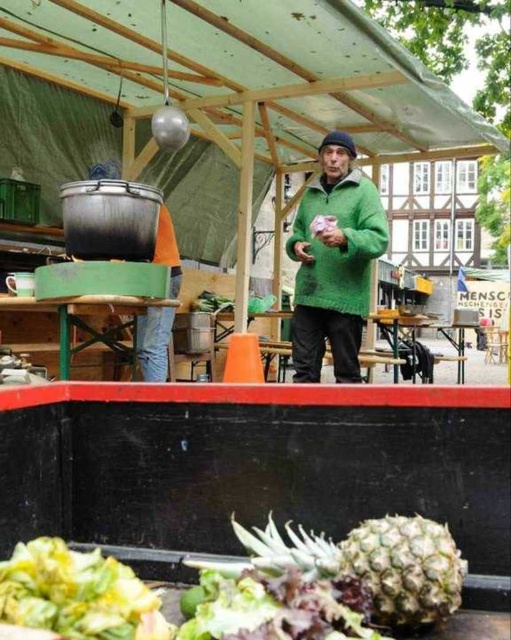
Question: Can you confirm if green rough pineapple at lower center is positioned to the right of green fuzzy sweater at center?

Choices:
 (A) yes
 (B) no

Answer: (B)

Question: Does wooden table at center have a smaller size compared to jeans at center?

Choices:
 (A) no
 (B) yes

Answer: (B)

Question: Does green rough pineapple at lower center have a smaller size compared to wooden table at center?

Choices:
 (A) no
 (B) yes

Answer: (B)

Question: Which of these objects is positioned farthest from the green fuzzy sweater at center?

Choices:
 (A) wooden table at center
 (B) jeans at center

Answer: (A)

Question: Estimate the real-world distances between objects in this image. Which object is farther from the green leafy vegetable at lower left?

Choices:
 (A) jeans at center
 (B) green fuzzy sweater at center

Answer: (B)

Question: Which point is closer to the camera?

Choices:
 (A) wooden table at center
 (B) green rough pineapple at lower center
 (C) jeans at center
 (D) green leafy vegetable at lower left

Answer: (D)